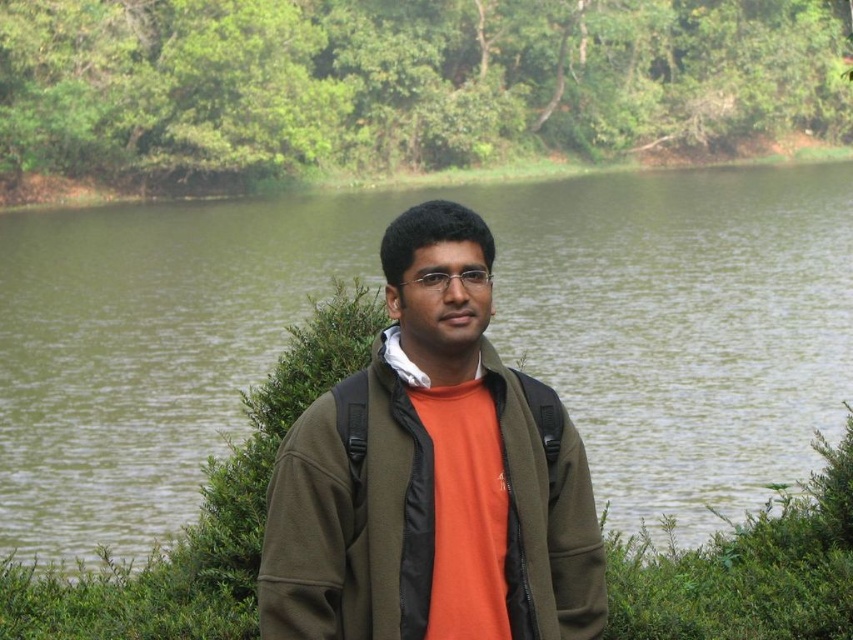
Between green water at center and matte green jacket at center, which one is positioned higher?

Positioned higher is green water at center.

Does green water at center lie in front of matte green jacket at center?

That is False.

Does point (120, 403) come closer to viewer compared to point (415, 416)?

No, (120, 403) is further to viewer.

Identify the location of green water at center. The height and width of the screenshot is (640, 853). (488, 332).